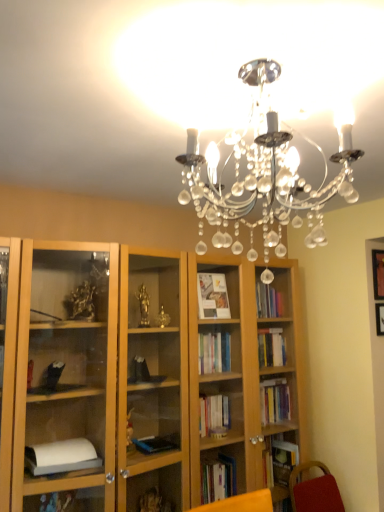
Looking at this image, in order to face clear crystal chandelier at center, should I rotate leftwards or rightwards?

Turn right by 14.273 degrees to look at clear crystal chandelier at center.

What is the approximate height of clear crystal chandelier at center?

It is 21.37 inches.

Where is `clear crystal chandelier at center`? This screenshot has width=384, height=512. clear crystal chandelier at center is located at coordinates (266, 169).

Describe the element at coordinates (266, 169) in the screenshot. The image size is (384, 512). I see `clear crystal chandelier at center` at that location.

Find the location of `clear crystal chandelier at center`. clear crystal chandelier at center is located at coordinates (266, 169).